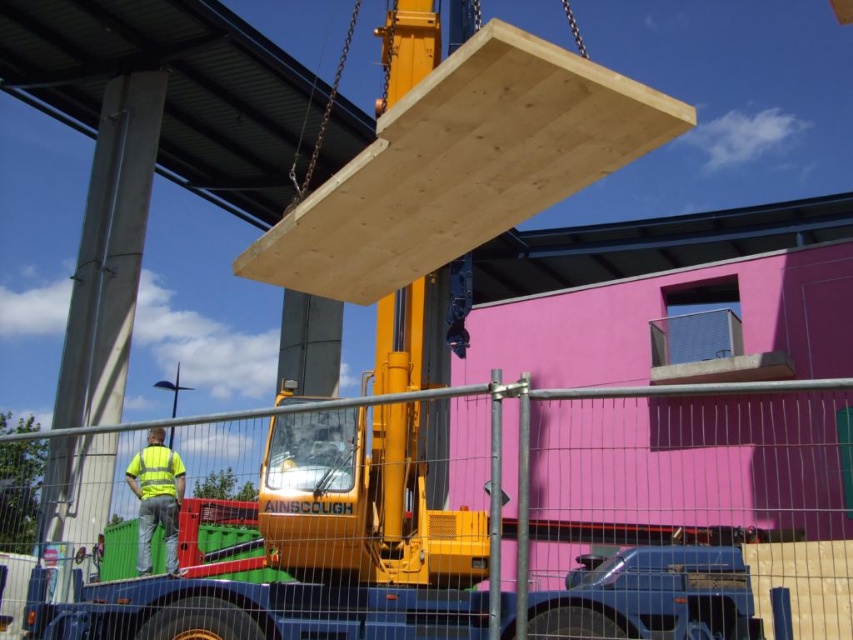
You are standing at the camera position observing the construction site. There are two points marked on the image at coordinates point (166, 550) and point (171, 493). Which point is closer to you?

Point (171, 493) is closer to you because it is in front of point (166, 550).

You are a safety inspector standing at the camera position. You need to check if the yellow reflective vest at lower left is within the 10 meters safety zone. Can you confirm?

The yellow reflective vest at lower left is 7.11 meters away from the camera, so it is within the 10 meters safety zone.